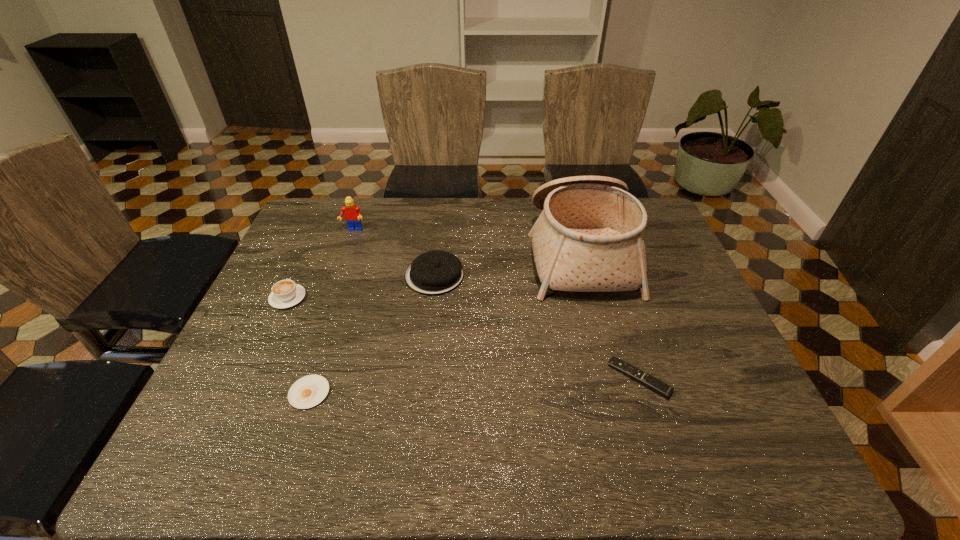
Image resolution: width=960 pixels, height=540 pixels. I want to click on the tallest object, so click(x=589, y=237).

You are a GUI agent. You are given a task and a screenshot of the screen. Output one action in this format:
    pyautogui.click(x=<x>, y=<y>)
    Task: Click on the fifth shortest object
    This screenshot has height=540, width=960.
    Given the screenshot: What is the action you would take?
    [x=352, y=212]

The width and height of the screenshot is (960, 540). In order to click on pancake in this screenshot , I will do `click(436, 272)`.

You are a GUI agent. You are given a task and a screenshot of the screen. Output one action in this format:
    pyautogui.click(x=<x>, y=<y>)
    Task: Click on the third tallest object
    Image resolution: width=960 pixels, height=540 pixels.
    Given the screenshot: What is the action you would take?
    pyautogui.click(x=436, y=272)

At what (x,y) coordinates should I click in order to perform the action: click on the leftmost object. Please return your answer as a coordinate pair (x, y). Image resolution: width=960 pixels, height=540 pixels. Looking at the image, I should click on (285, 293).

The height and width of the screenshot is (540, 960). What are the coordinates of `cappuccino` in the screenshot? It's located at (285, 293).

The image size is (960, 540). Identify the location of remote control. (654, 384).

What are the coordinates of `the shortest object` in the screenshot? It's located at (308, 391).

Locate an element on the screen. This screenshot has height=540, width=960. free location located with the lid open on the basket is located at coordinates (432, 252).

Find the location of a particular element. The height and width of the screenshot is (540, 960). vacant area located with the lid open on the basket is located at coordinates (462, 252).